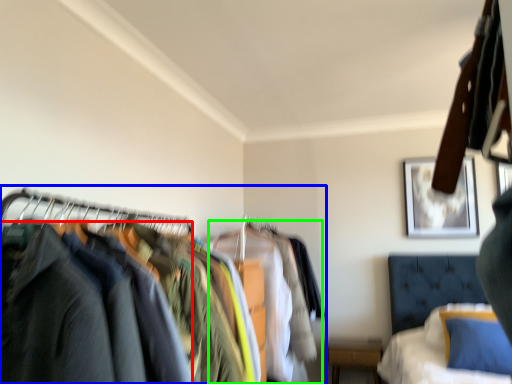
Question: Which object is the farthest from clothing (highlighted by a red box)? Choose among these: closet (highlighted by a blue box) or clothing (highlighted by a green box).

Choices:
 (A) closet
 (B) clothing

Answer: (B)